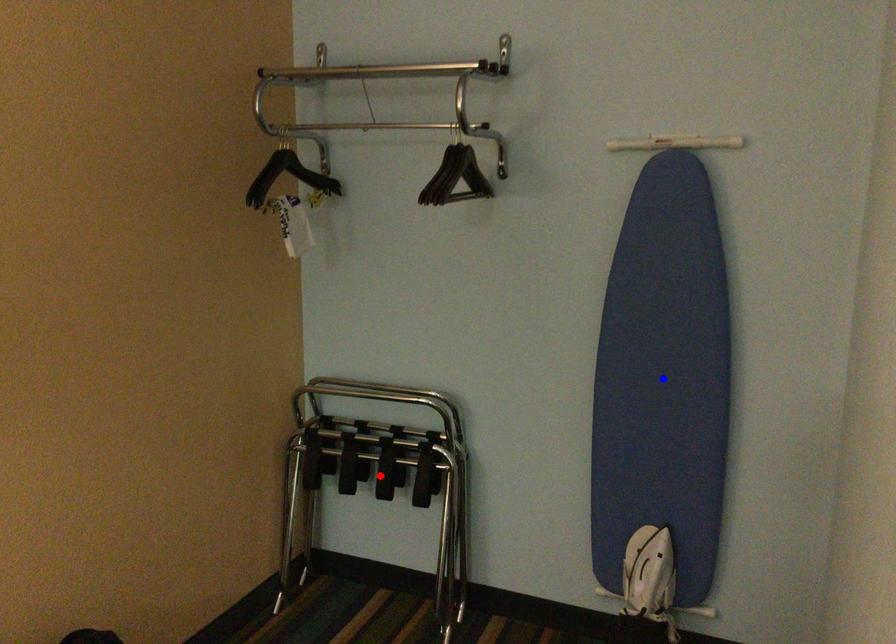
Question: Which of the two points in the image is closer to the camera?

Choices:
 (A) Blue point is closer.
 (B) Red point is closer.

Answer: (A)